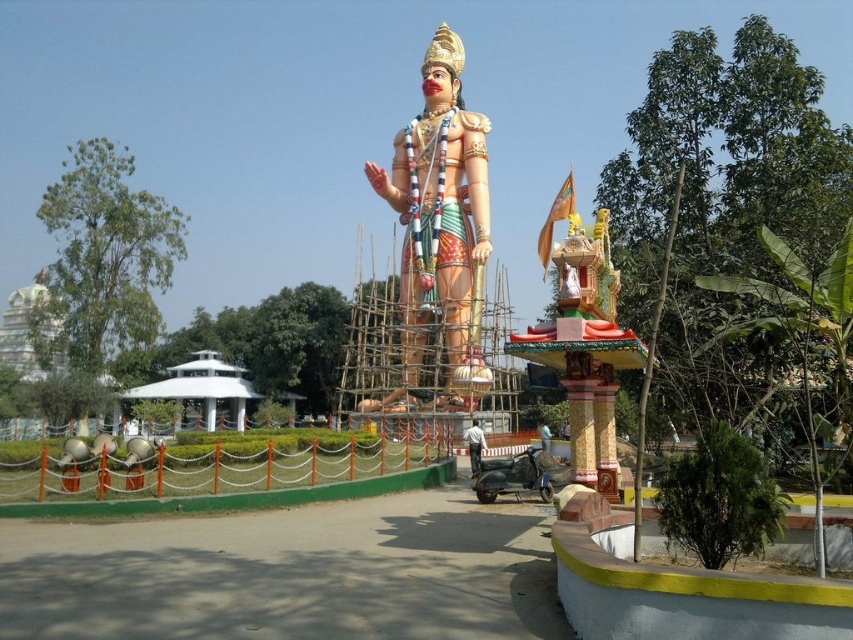
You are a visitor at a temple and want to take a photo of the matte plastic statue at center and the metallic helmet at center. Which object should you focus on first if you want to include both in a single frame without zooming in or out?

The matte plastic statue at center is larger than the metallic helmet at center, so you should focus on the statue first to ensure it fits properly in the frame before adjusting for the smaller helmet.

What are the coordinates of the matte plastic statue at center?

The coordinates of the matte plastic statue at center are at point (440,224).

You are a visitor at the statue site and want to take a photo of the matte plastic statue at center and the metallic helmet at center. Which object should you focus on first if you want to capture both in the same frame without moving your camera?

The matte plastic statue at center is located above the metallic helmet at center, so you should focus on the metallic helmet at center first to ensure both are in the frame.